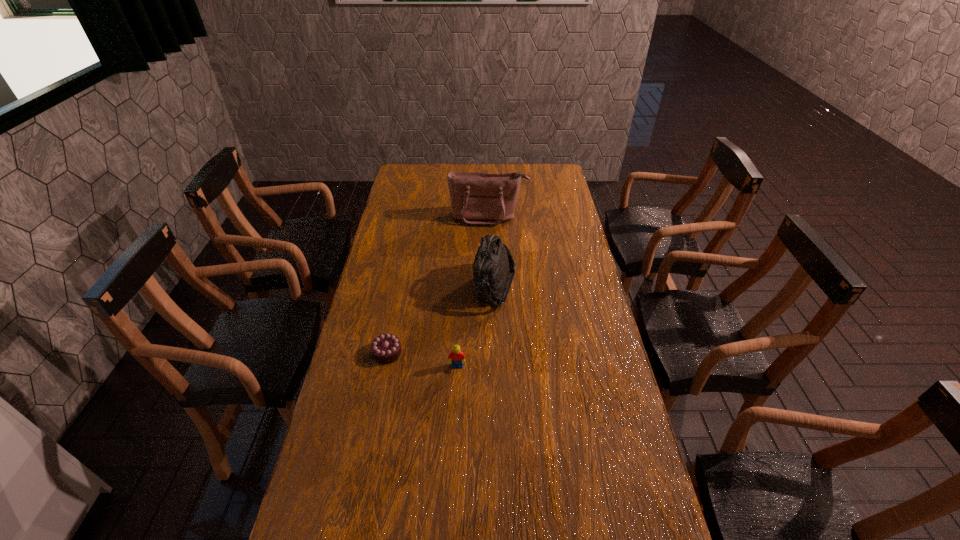
Where is `vacant space located on the front of the shortest object`? The height and width of the screenshot is (540, 960). vacant space located on the front of the shortest object is located at coordinates (378, 401).

Identify the location of object at the left edge. This screenshot has height=540, width=960. (386, 348).

Where is `vacant space at the left edge of the desktop`? This screenshot has width=960, height=540. vacant space at the left edge of the desktop is located at coordinates (409, 200).

The width and height of the screenshot is (960, 540). I want to click on blank space at the right edge, so click(566, 272).

At what (x,y) coordinates should I click in order to perform the action: click on vacant space at the far left corner of the desktop. Please return your answer as a coordinate pair (x, y). The height and width of the screenshot is (540, 960). Looking at the image, I should click on click(409, 184).

Image resolution: width=960 pixels, height=540 pixels. Identify the location of vacant position at the far right corner of the desktop. (544, 165).

In order to click on free space between the second shortest object and the farther shoulder bag in this screenshot , I will do `click(473, 292)`.

Image resolution: width=960 pixels, height=540 pixels. In order to click on vacant area that lies between the shortest object and the farther shoulder bag in this screenshot , I will do `click(438, 285)`.

At what (x,y) coordinates should I click in order to perform the action: click on vacant region between the chocolate cake and the second shortest object. Please return your answer as a coordinate pair (x, y). Looking at the image, I should click on 422,360.

I want to click on free point between the nearer shoulder bag and the second shortest object, so click(x=476, y=327).